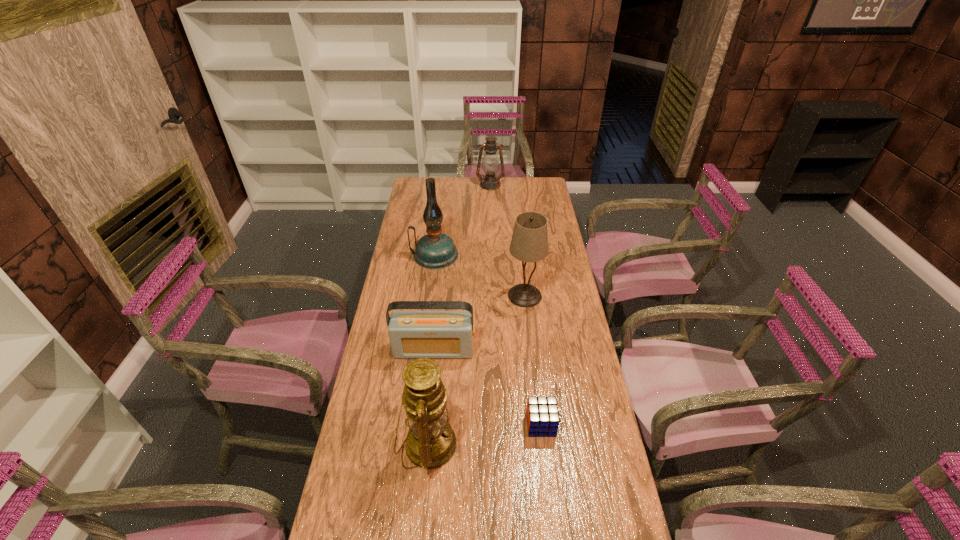
Where is `free space located 0.180m on the back of the second nearest oil lamp`? free space located 0.180m on the back of the second nearest oil lamp is located at coordinates (439, 220).

The height and width of the screenshot is (540, 960). I want to click on vacant space located 0.280m on the back of the nearest oil lamp, so click(438, 341).

Locate an element on the screen. vacant space located 0.350m on the front-facing side of the third nearest object is located at coordinates (422, 459).

The width and height of the screenshot is (960, 540). I want to click on vacant region located 0.300m on the left of the cube, so click(427, 424).

Locate an element on the screen. This screenshot has width=960, height=540. object located at the far edge is located at coordinates (490, 164).

Identify the location of radio receiver that is positioned at the left edge. (413, 334).

At what (x,y) coordinates should I click in order to perform the action: click on lampshade located in the right edge section of the desktop. Please return your answer as a coordinate pair (x, y). Looking at the image, I should click on (529, 243).

At what (x,y) coordinates should I click in order to perform the action: click on cube located at the right edge. Please return your answer as a coordinate pair (x, y). Image resolution: width=960 pixels, height=540 pixels. Looking at the image, I should click on (542, 415).

In the image, there is a desktop. Where is `free region at the far edge`? The width and height of the screenshot is (960, 540). free region at the far edge is located at coordinates (472, 177).

At what (x,y) coordinates should I click in order to perform the action: click on free space at the left edge. Please return your answer as a coordinate pair (x, y). This screenshot has height=540, width=960. Looking at the image, I should click on (398, 506).